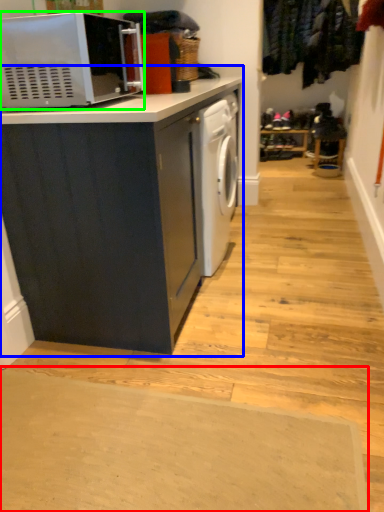
Question: Which is nearer to the doormat (highlighted by a red box)? cabinetry (highlighted by a blue box) or microwave oven (highlighted by a green box).

Choices:
 (A) cabinetry
 (B) microwave oven

Answer: (A)